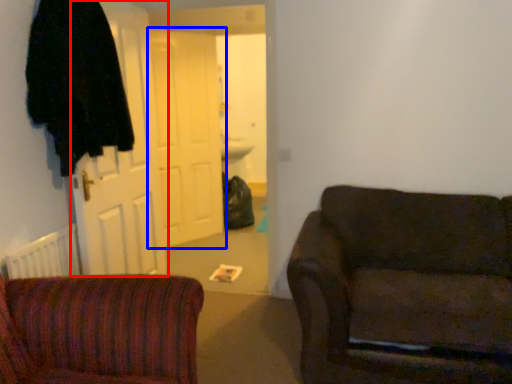
Question: Among these objects, which one is farthest to the camera, door (highlighted by a red box) or door (highlighted by a blue box)?

Choices:
 (A) door
 (B) door

Answer: (B)